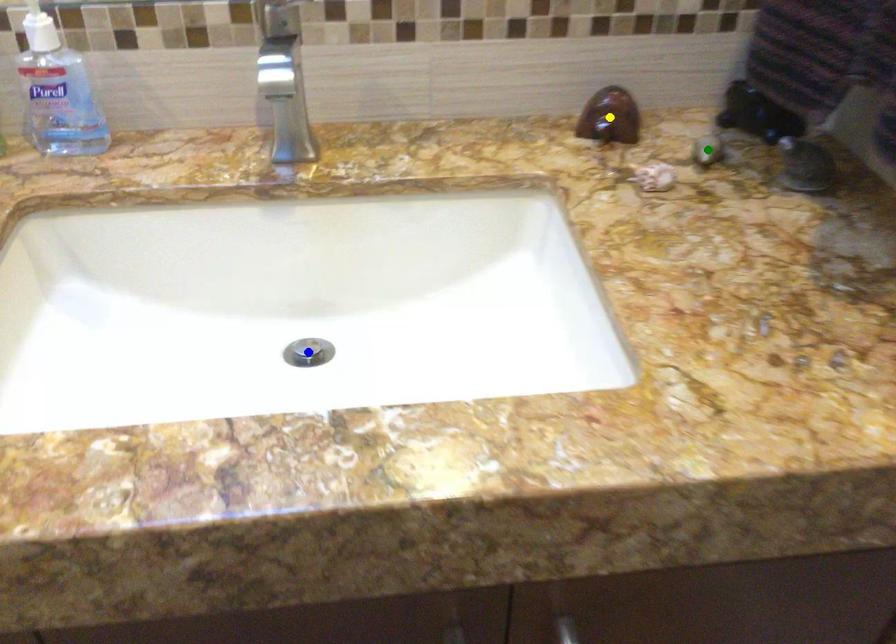
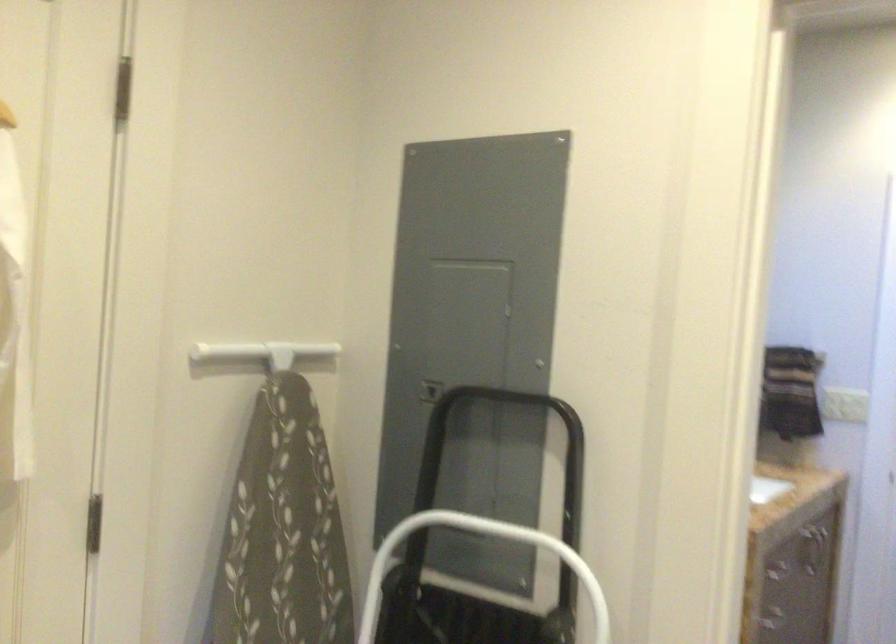
I am providing you with two images of the same scene from different viewpoints. Three points are marked in image1. Which point corresponds to a part or object that is occluded in image2?In image1, three points are marked. Which of them correspond to a part or object that is occluded in image2?Among the three points shown in image1, which one corresponds to a part or object that is no longer visible due to occlusion in image2?

Invisible in image2: green point, yellow point, blue point.